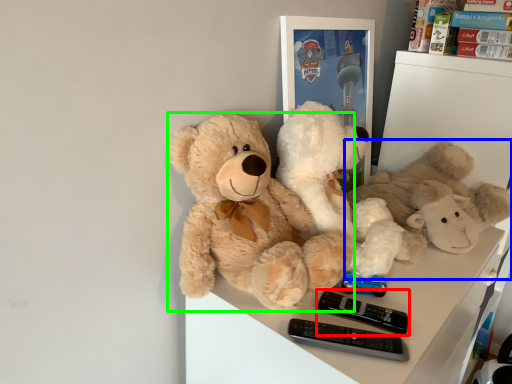
Question: Considering the real-world distances, which object is farthest from control (highlighted by a red box)? teddy bear (highlighted by a blue box) or teddy bear (highlighted by a green box)?

Choices:
 (A) teddy bear
 (B) teddy bear

Answer: (A)